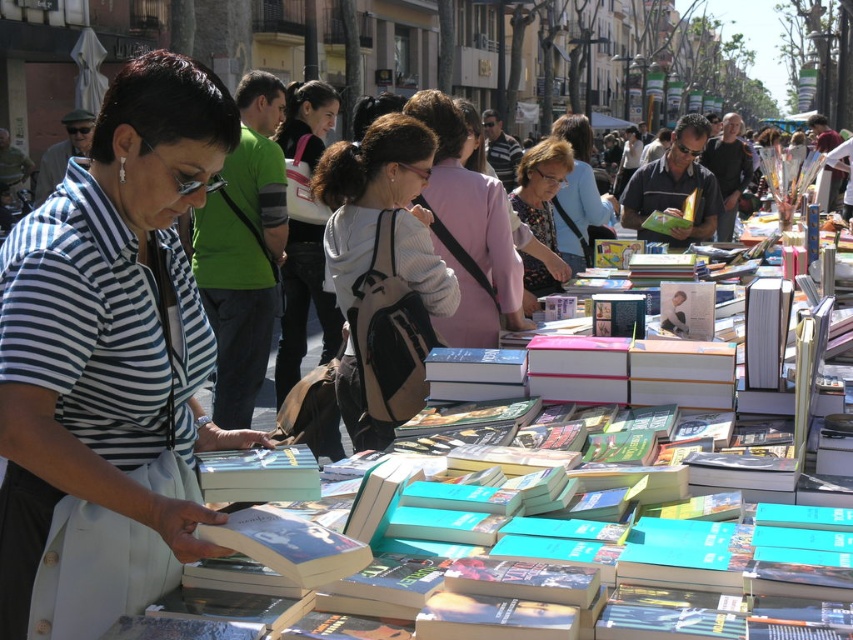
Question: Estimate the real-world distances between objects in this image. Which object is closer to the light gray backpack at center?

Choices:
 (A) patterned fabric blouse at center
 (B) green matte book at center

Answer: (A)

Question: Can you confirm if hardcover book at center is wider than pink fabric at center?

Choices:
 (A) no
 (B) yes

Answer: (A)

Question: Estimate the real-world distances between objects in this image. Which object is farther from the pink fabric at center?

Choices:
 (A) matte pink backpack at center
 (B) light gray backpack at center
 (C) striped fabric shirt at center
 (D) patterned fabric blouse at center

Answer: (C)

Question: Does pink fabric at center appear over green matte book at center?

Choices:
 (A) yes
 (B) no

Answer: (A)

Question: Considering the relative positions of striped fabric shirt at center and green matte book at center in the image provided, where is striped fabric shirt at center located with respect to green matte book at center?

Choices:
 (A) right
 (B) left

Answer: (B)

Question: Which object is positioned closest to the matte green book at center?

Choices:
 (A) pink fabric at center
 (B) green matte book at center
 (C) hardcover book at center

Answer: (B)